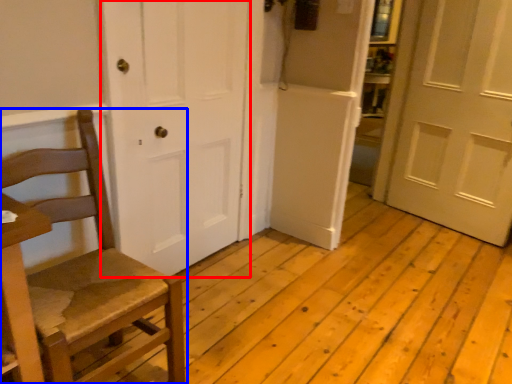
Question: Among these objects, which one is farthest to the camera, door (highlighted by a red box) or chair (highlighted by a blue box)?

Choices:
 (A) door
 (B) chair

Answer: (A)